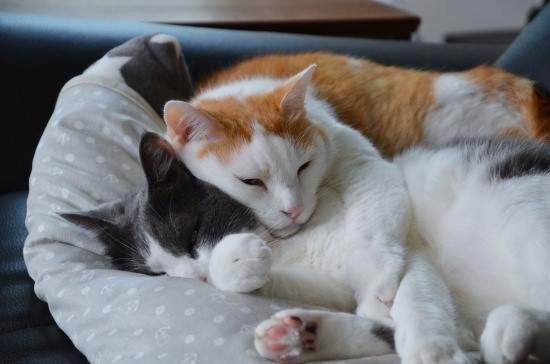
Find the location of a particular element. The image size is (550, 364). wall is located at coordinates (446, 19).